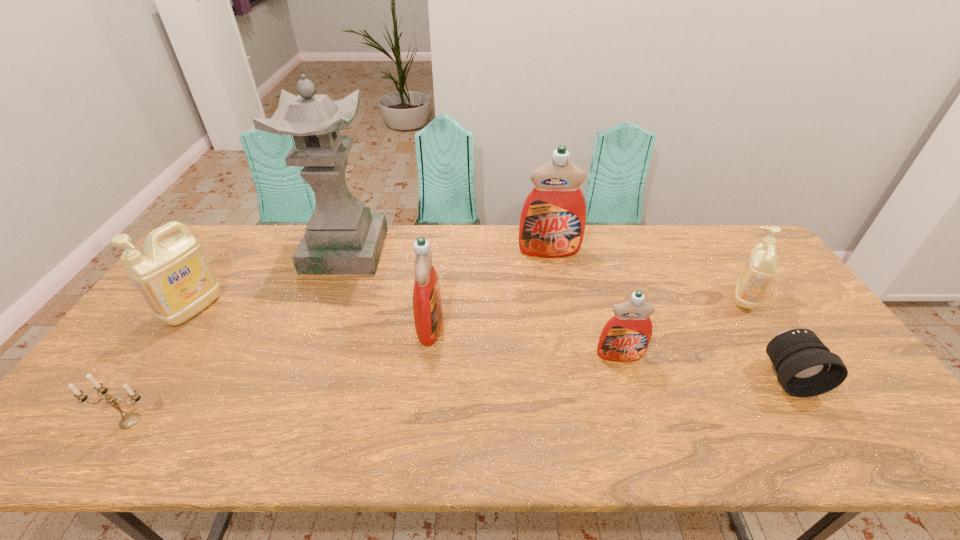
Identify the location of red detergent that is the third closest to the metallic candle. The height and width of the screenshot is (540, 960). pos(626,336).

Where is `free region that satisfies the following two spatial constraints: 1. at the front opening of the tallest object; 2. on the front side of the metallic candle`? This screenshot has width=960, height=540. free region that satisfies the following two spatial constraints: 1. at the front opening of the tallest object; 2. on the front side of the metallic candle is located at coordinates (281, 421).

Where is `vacant space that satisfies the following two spatial constraints: 1. on the front surface of the farthest red detergent; 2. on the left side of the rightmost detergent`? This screenshot has height=540, width=960. vacant space that satisfies the following two spatial constraints: 1. on the front surface of the farthest red detergent; 2. on the left side of the rightmost detergent is located at coordinates (559, 298).

The height and width of the screenshot is (540, 960). Identify the location of vacant area in the image that satisfies the following two spatial constraints: 1. on the front surface of the biggest red detergent; 2. on the front surface of the second smallest red detergent. (564, 325).